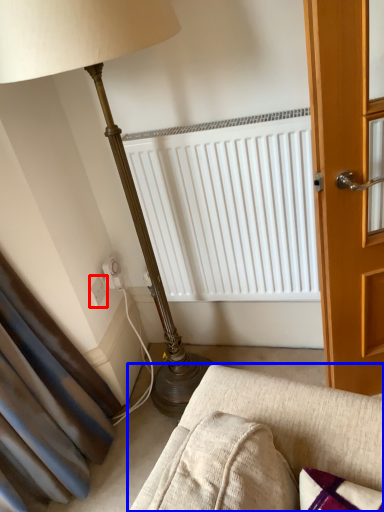
Question: Which object is closer to the camera taking this photo, electric outlet (highlighted by a red box) or studio couch (highlighted by a blue box)?

Choices:
 (A) electric outlet
 (B) studio couch

Answer: (B)